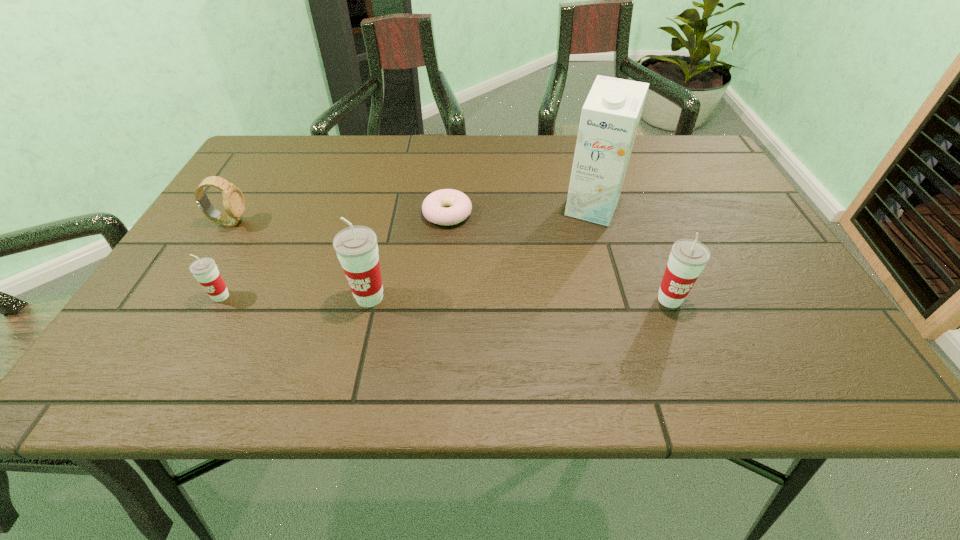
Where is `spot to insert another cup for uniform distribution`? This screenshot has height=540, width=960. spot to insert another cup for uniform distribution is located at coordinates click(x=519, y=299).